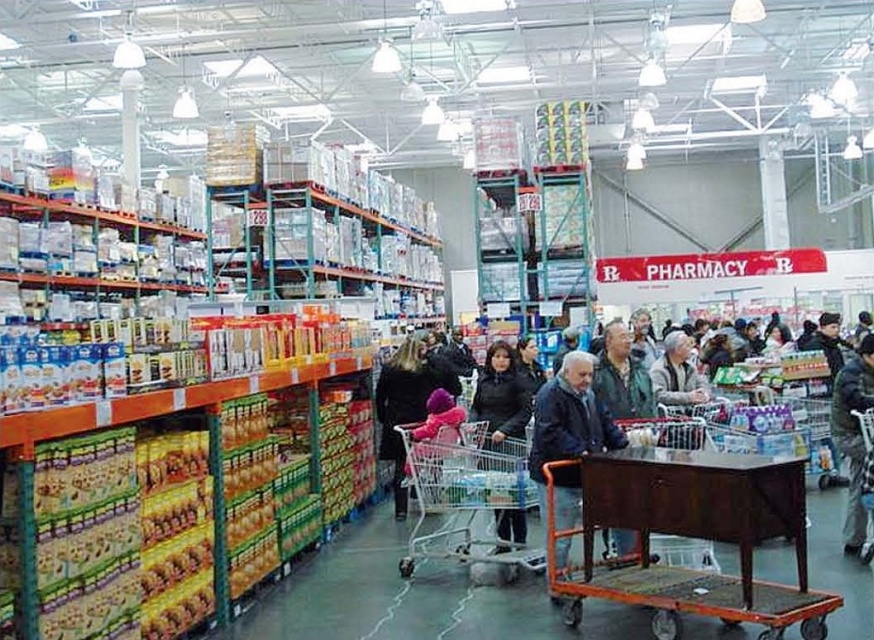
Question: From the image, what is the correct spatial relationship of dark blue jacket at center in relation to dark gray coat at center?

Choices:
 (A) below
 (B) above

Answer: (B)

Question: Which point appears farthest from the camera in this image?

Choices:
 (A) (420, 408)
 (B) (498, 548)

Answer: (A)

Question: Which of the following is the closest to the observer?

Choices:
 (A) (490, 416)
 (B) (406, 561)
 (C) (647, 461)

Answer: (C)

Question: Is dark blue jacket at center above dark gray coat at center?

Choices:
 (A) no
 (B) yes

Answer: (B)

Question: Can you confirm if dark gray coat at center is positioned to the left of black matte coat at center?

Choices:
 (A) yes
 (B) no

Answer: (A)

Question: Which of the following is the closest to the observer?

Choices:
 (A) (796, 536)
 (B) (503, 541)

Answer: (A)